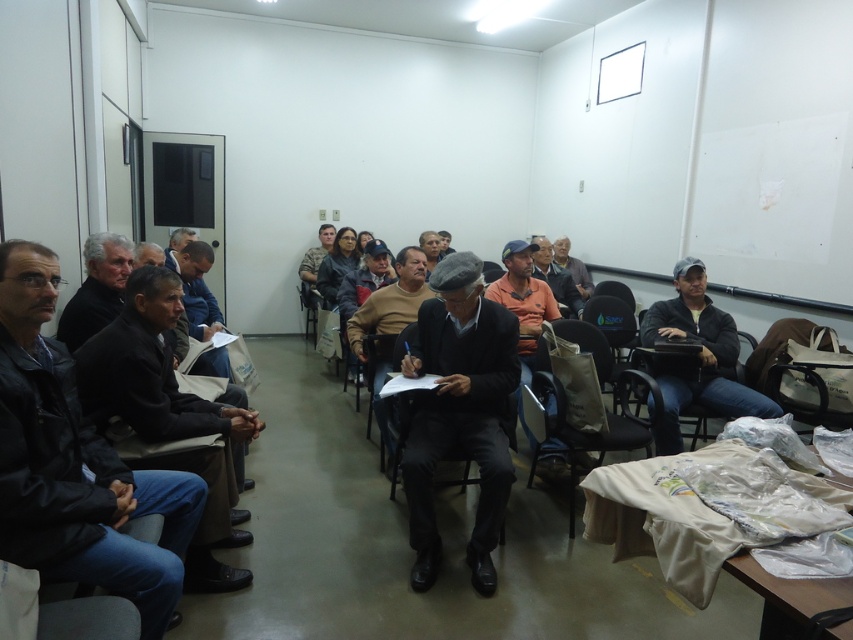
Question: Is dark brown leather jacket at left bigger than gray fabric cap at right?

Choices:
 (A) yes
 (B) no

Answer: (A)

Question: Which point is farther to the camera?

Choices:
 (A) (717, 342)
 (B) (12, 330)

Answer: (A)

Question: Which point is farther to the camera?

Choices:
 (A) (79, 416)
 (B) (381, 339)

Answer: (B)

Question: Does gray fabric cap at right have a greater width compared to matte gray shirt at center?

Choices:
 (A) yes
 (B) no

Answer: (A)

Question: Does beige fabric chair at center have a greater width compared to matte gray shirt at center?

Choices:
 (A) no
 (B) yes

Answer: (B)

Question: Which point is farther to the camera?

Choices:
 (A) gray fabric jacket at center
 (B) beige fabric chair at center
 (C) orange cotton shirt at center
 (D) matte gray shirt at center

Answer: (A)